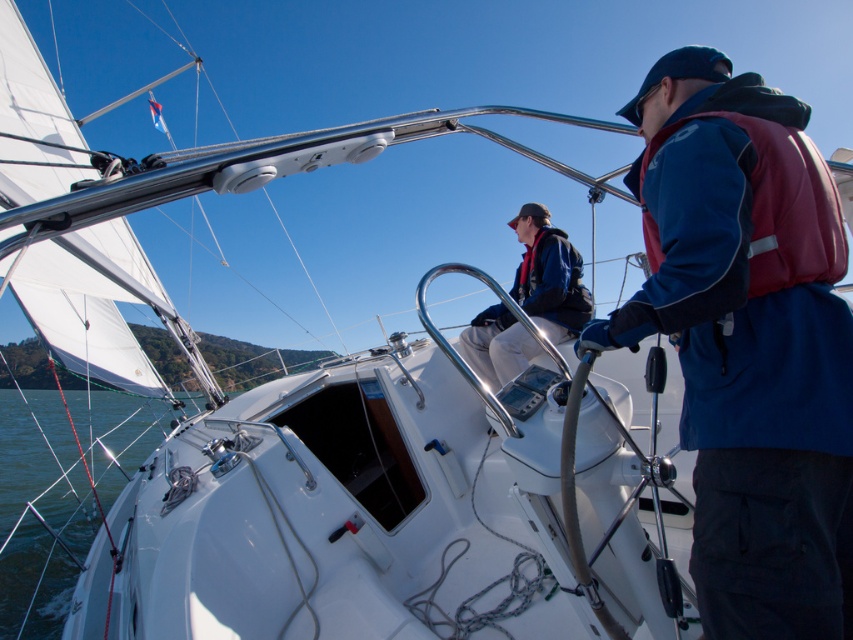
You are a sailor on the deck of the sailboat and need to put on your life jacket. Which item is on top, the maroon synthetic life jacket at right or the blue fabric jacket at center?

The maroon synthetic life jacket at right is positioned over the blue fabric jacket at center, so the maroon synthetic life jacket at right is on top.

You are on a sailboat and need to find the blue fleece jacket at center. According to the coordinates provided, where would you look relative to the boat?

The blue fleece jacket at center is located at the coordinates point (747, 340) on the boat.